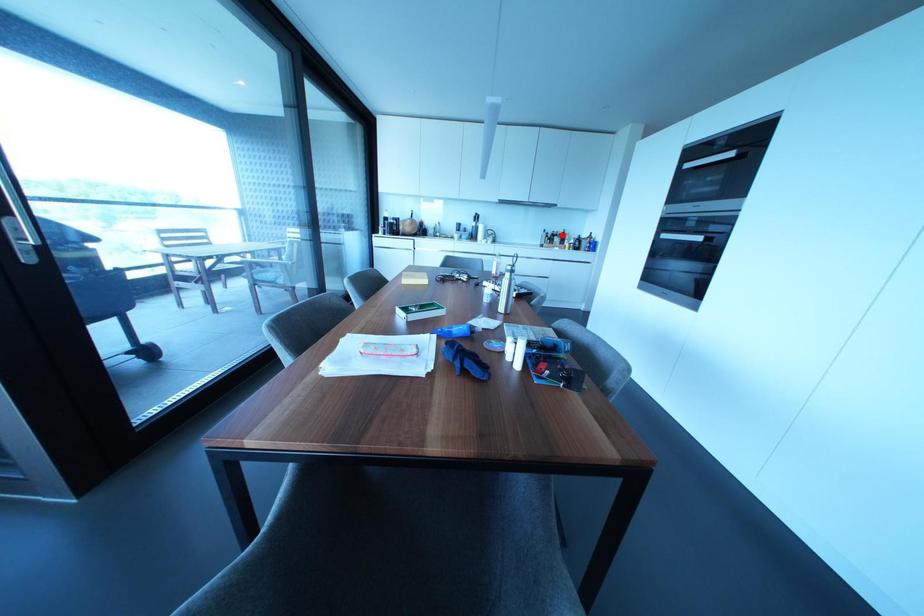
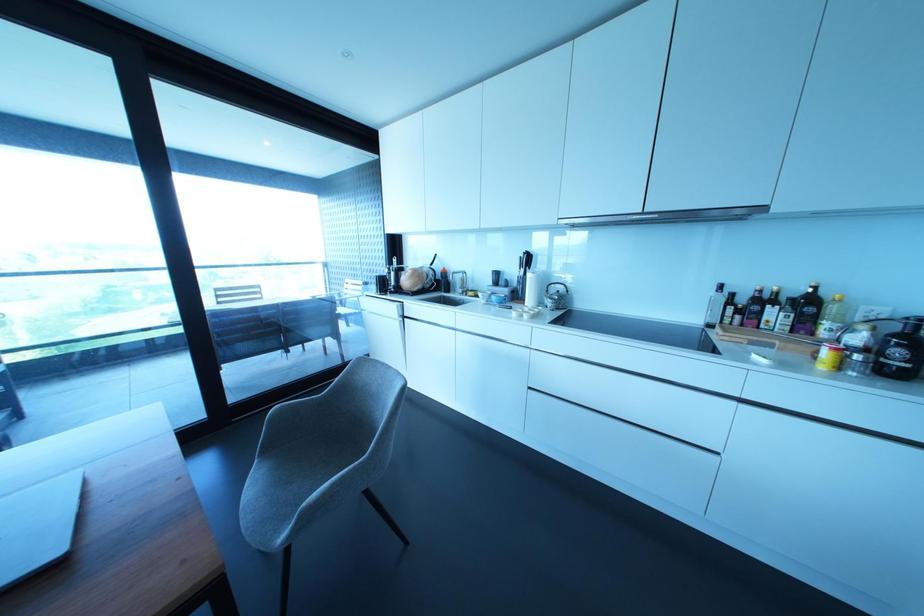
Question: I am providing you with two images of the same scene from different viewpoints. Image1 has a red point marked. In image2, the corresponding 3D location appears at what relative position? Reply with the corresponding letter.

Choices:
 (A) Closer
 (B) Farther

Answer: (B)